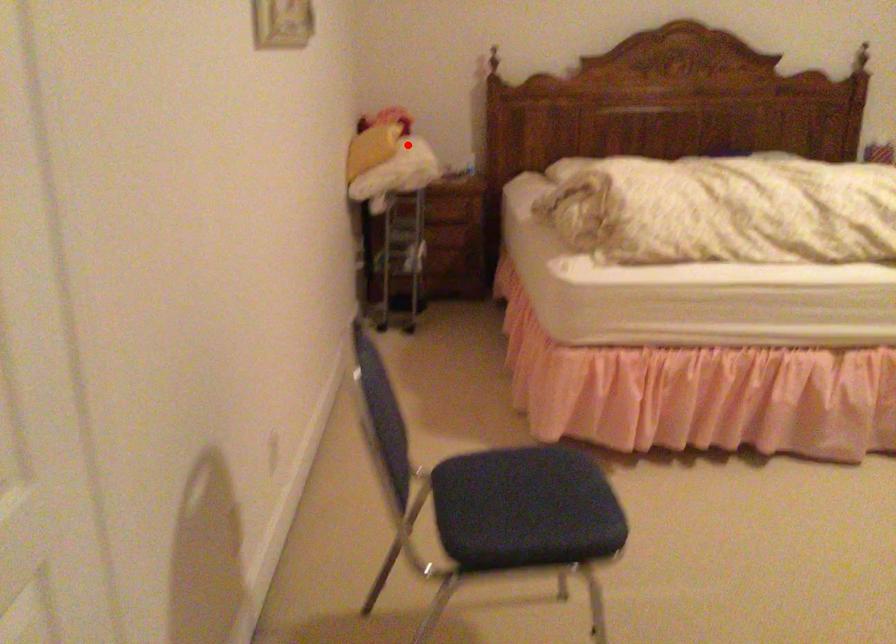
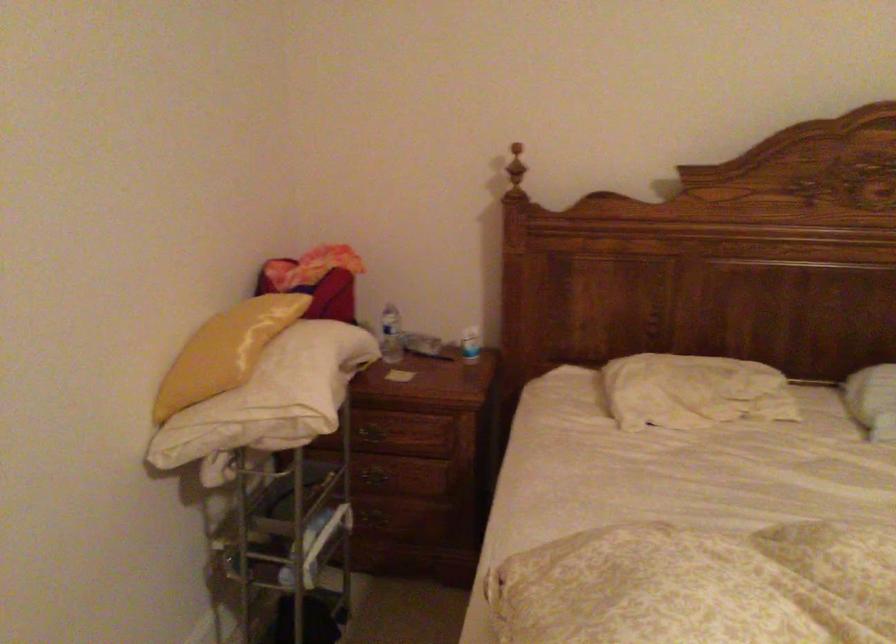
Question: A red point is marked in image1. In image2, is the corresponding 3D point closer to the camera or farther? Reply with the corresponding letter.

Choices:
 (A) The corresponding 3D point is closer.
 (B) The corresponding 3D point is farther.

Answer: (A)